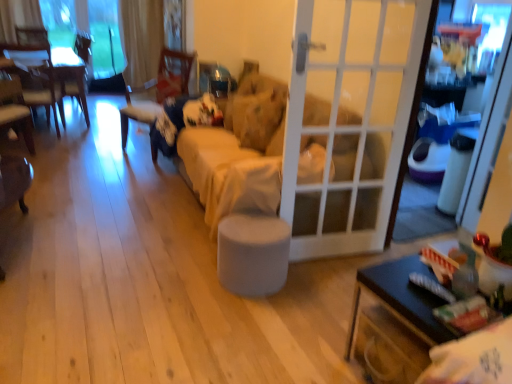
Find the location of a particular element. This screenshot has height=384, width=512. free region under white glass door at center (from a real-world perspective) is located at coordinates (328, 253).